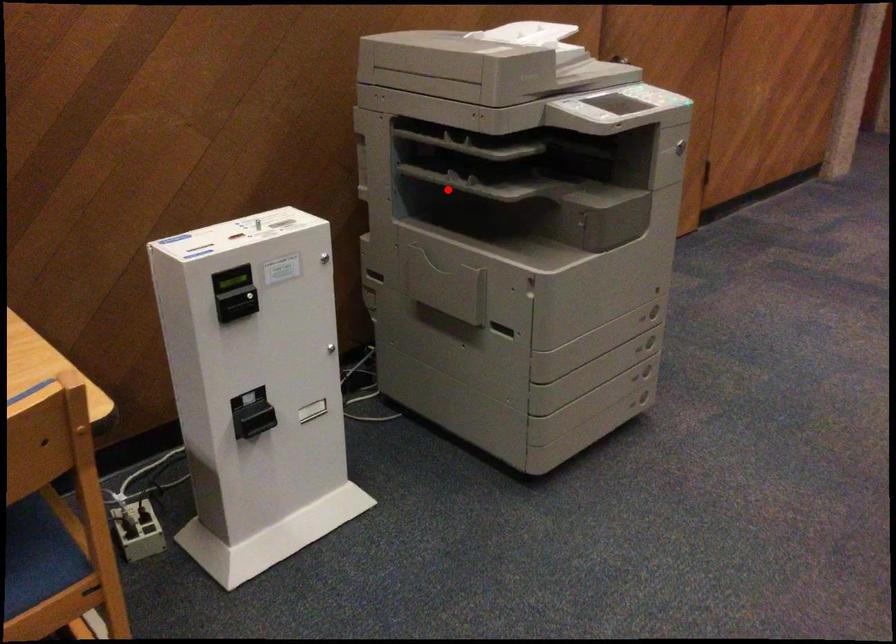
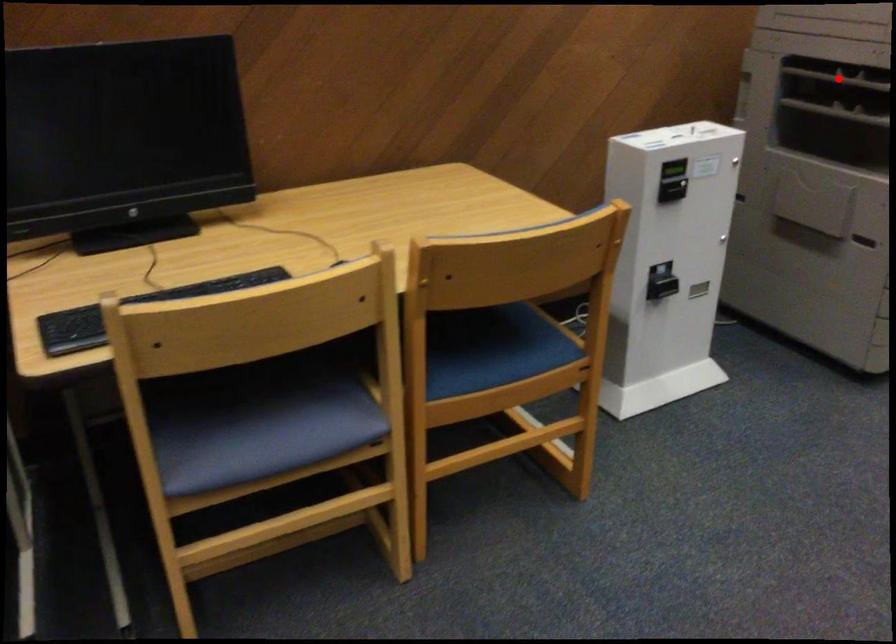
I am providing you with two images of the same scene from different viewpoints. A red point is marked on the first image and another point is marked on the second image. Is the marked point in image1 the same physical position as the marked point in image2?

No